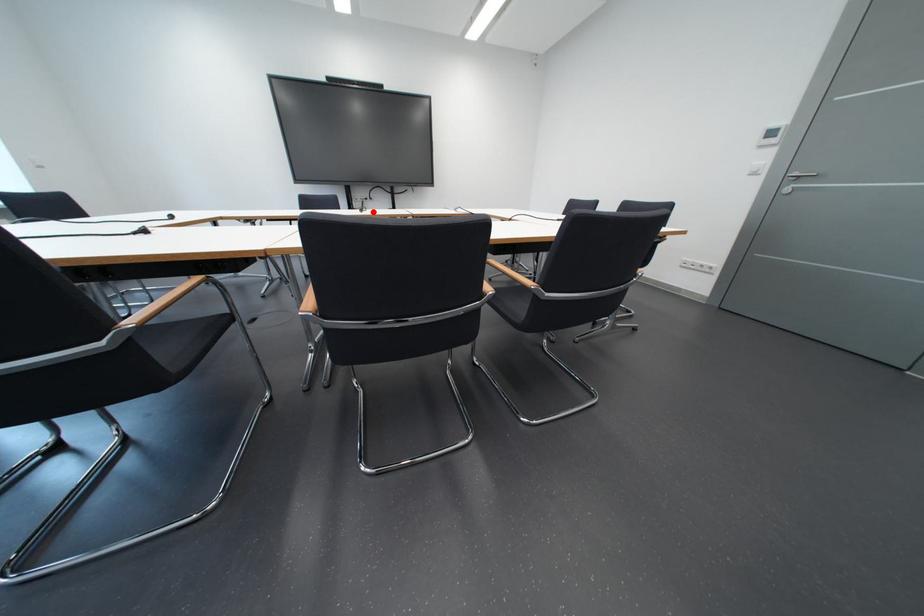
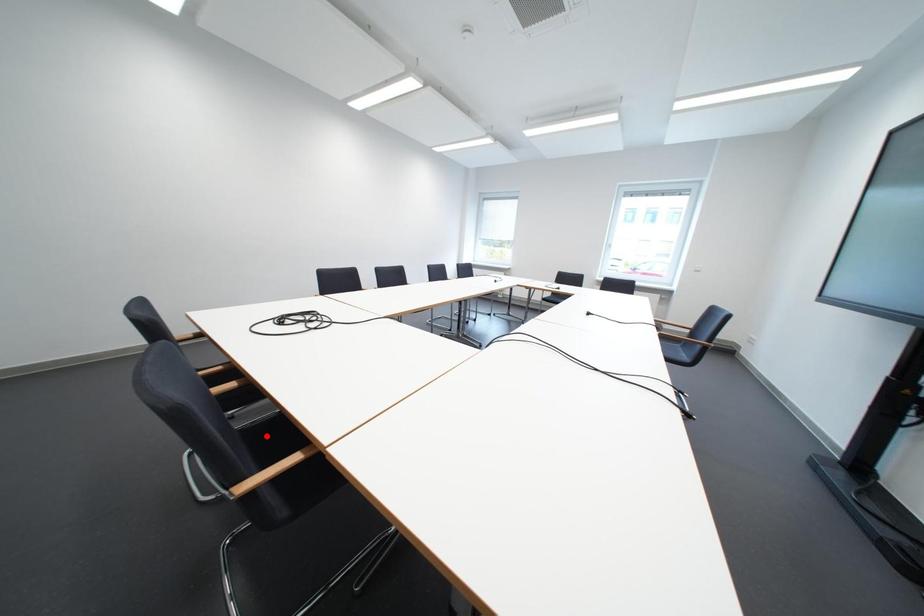
I am providing you with two images of the same scene from different viewpoints. A red point is marked on the first image and another point is marked on the second image. Is the marked point in image1 the same physical position as the marked point in image2?

No